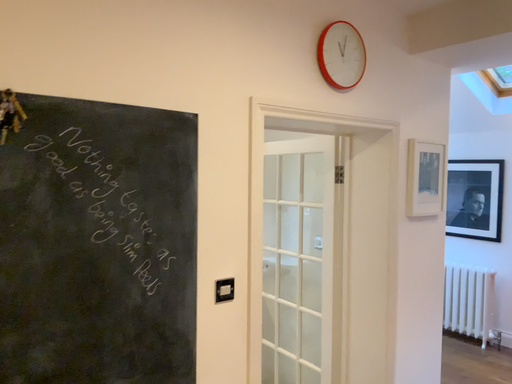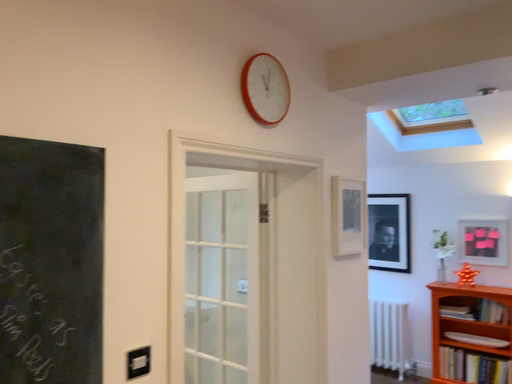
Question: Which way did the camera rotate in the video?

Choices:
 (A) rotated right
 (B) rotated left

Answer: (A)